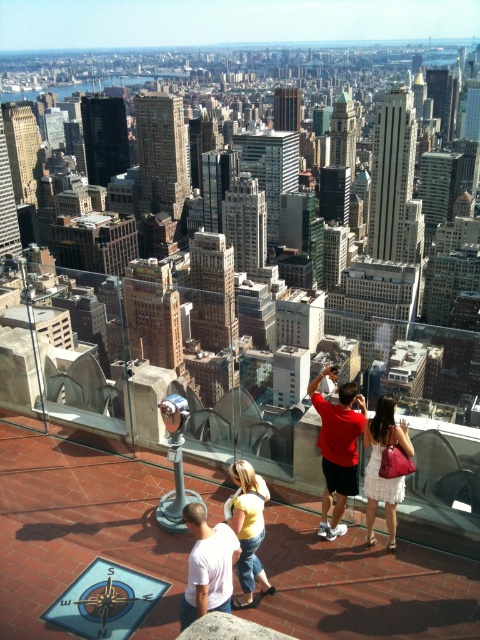
Can you confirm if white lace dress at center is positioned to the right of yellow cotton shirt at center?

Correct, you'll find white lace dress at center to the right of yellow cotton shirt at center.

Is point (382, 428) in front of point (240, 493)?

That is False.

Locate an element on the screen. white lace dress at center is located at coordinates (380, 467).

Identify the location of white lace dress at center. The width and height of the screenshot is (480, 640). (380, 467).

Can you confirm if matte red shirt at center is bigger than yellow cotton shirt at center?

Actually, matte red shirt at center might be smaller than yellow cotton shirt at center.

Does point (333, 444) lie in front of point (230, 504)?

That is False.

Image resolution: width=480 pixels, height=640 pixels. What do you see at coordinates (337, 448) in the screenshot?
I see `matte red shirt at center` at bounding box center [337, 448].

The height and width of the screenshot is (640, 480). Find the location of `matte red shirt at center`. matte red shirt at center is located at coordinates (337, 448).

Is the position of matte red shirt at center less distant than that of white lace dress at center?

No.

Between point (315, 392) and point (387, 486), which one is positioned behind?

Point (315, 392)

Between point (348, 492) and point (385, 509), which one is positioned behind?

The point (348, 492) is behind.

Identify the location of matte red shirt at center. Image resolution: width=480 pixels, height=640 pixels. (337, 448).